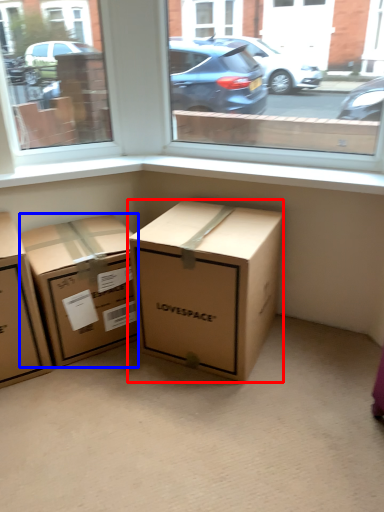
Question: Which object appears closest to the camera in this image, box (highlighted by a red box) or box (highlighted by a blue box)?

Choices:
 (A) box
 (B) box

Answer: (A)